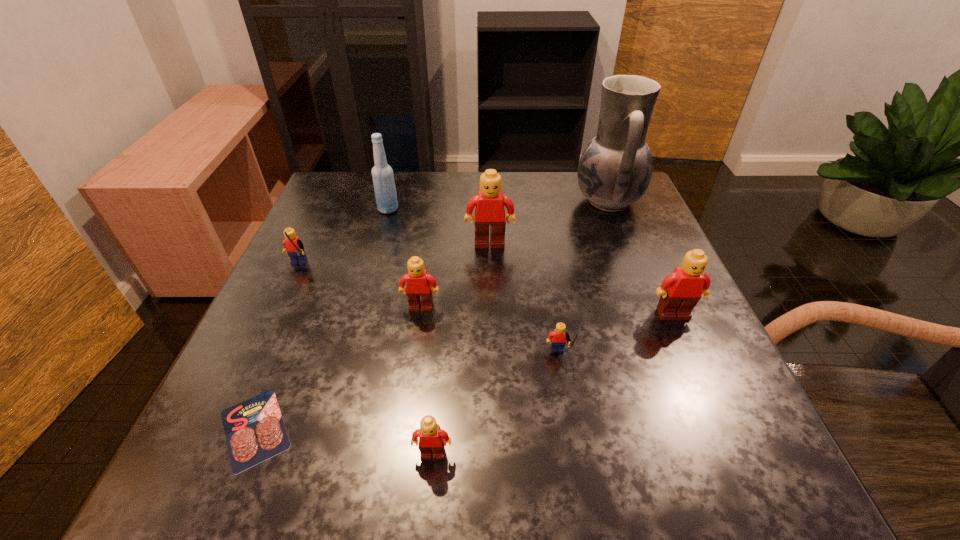
You are a GUI agent. You are given a task and a screenshot of the screen. Output one action in this format:
    pyautogui.click(x=<x>, y=<y>)
    Task: Click on the blank region between the second tallest Lego and the right yellow Lego
    This screenshot has width=960, height=540.
    Given the screenshot: What is the action you would take?
    pyautogui.click(x=616, y=336)

At what (x,y) coordinates should I click in order to perform the action: click on object that is the eighth nearest to the salami. Please return your answer as a coordinate pair (x, y). Looking at the image, I should click on (615, 169).

This screenshot has width=960, height=540. I want to click on object that is the seventh closest one to the biggest brown Lego, so click(x=254, y=429).

Locate which Lego ranks fifth in proximity to the tallest object. Please provide its 2D coordinates. Your answer should be formatted as a tuple, i.e. [(x, y)], where the tuple contains the x and y coordinates of a point satisfying the conditions above.

[(292, 244)]

Choose which Lego is the third nearest neighbor to the second farthest Lego. Please provide its 2D coordinates. Your answer should be formatted as a tuple, i.e. [(x, y)], where the tuple contains the x and y coordinates of a point satisfying the conditions above.

[(432, 439)]

The width and height of the screenshot is (960, 540). What are the coordinates of `brown Lego that stands as the second closest to the bottle` in the screenshot? It's located at (418, 290).

Locate which brown Lego is the closest to the third farthest object. Please provide its 2D coordinates. Your answer should be formatted as a tuple, i.e. [(x, y)], where the tuple contains the x and y coordinates of a point satisfying the conditions above.

[(418, 290)]